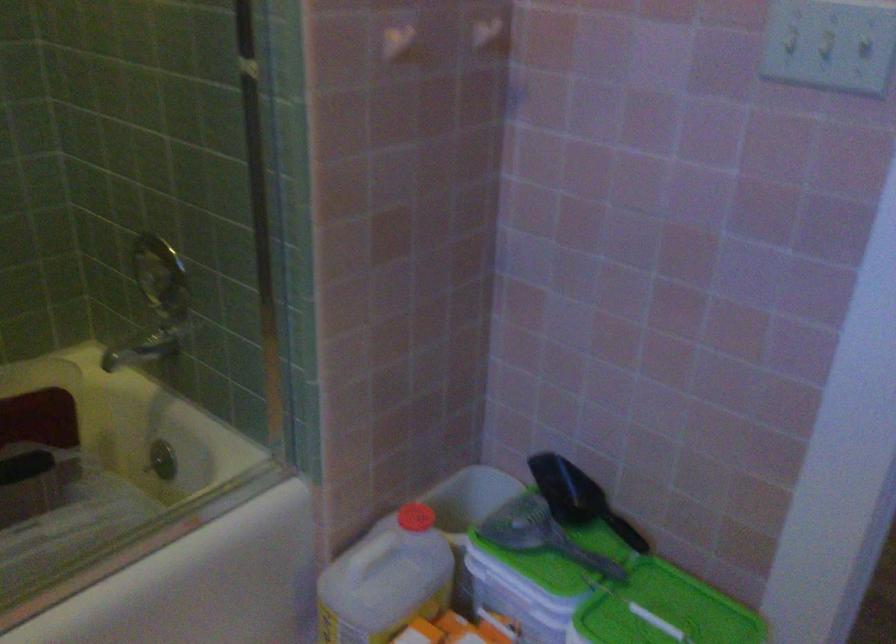
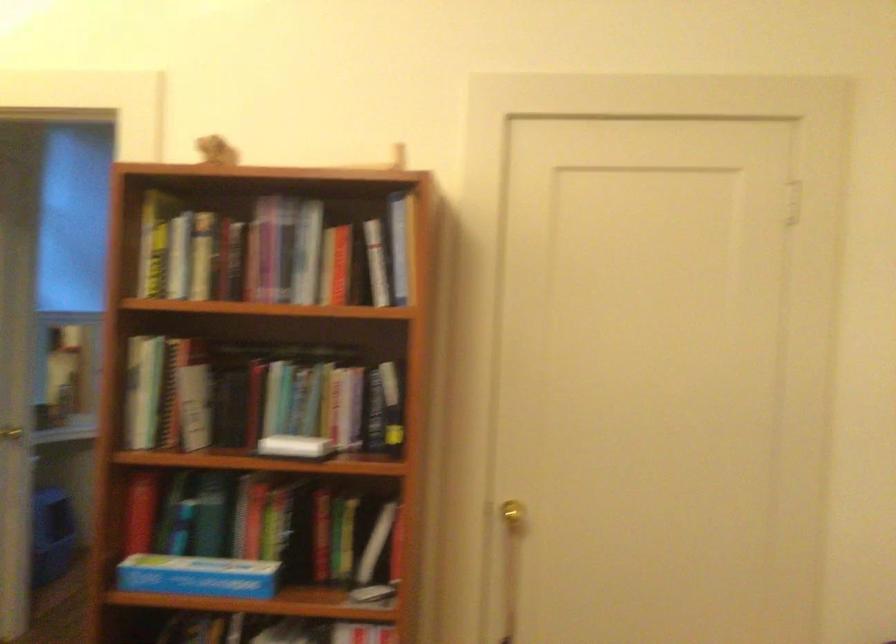
Question: I am providing you with two images of the same scene from different viewpoints. Please identify which objects are invisible in image2.

Choices:
 (A) small brown figurine
 (B) red bottle cap
 (C) folding step ladder
 (D) book

Answer: (B)